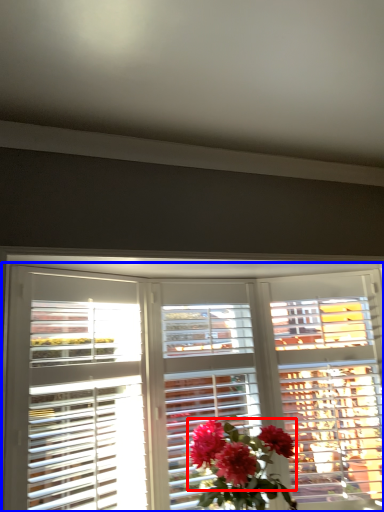
Question: Among these objects, which one is farthest to the camera, flower (highlighted by a red box) or window (highlighted by a blue box)?

Choices:
 (A) flower
 (B) window

Answer: (A)